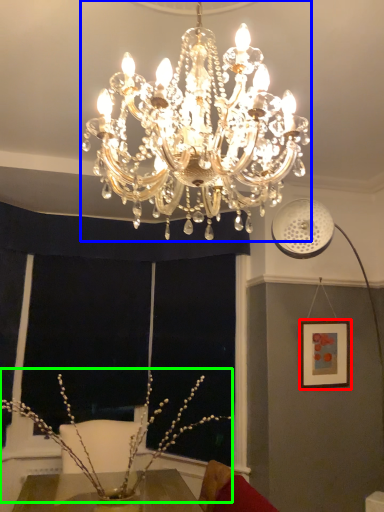
Question: Which object is the farthest from picture frame (highlighted by a red box)? Choose among these: lamp (highlighted by a blue box) or floral arrangement (highlighted by a green box).

Choices:
 (A) lamp
 (B) floral arrangement

Answer: (A)